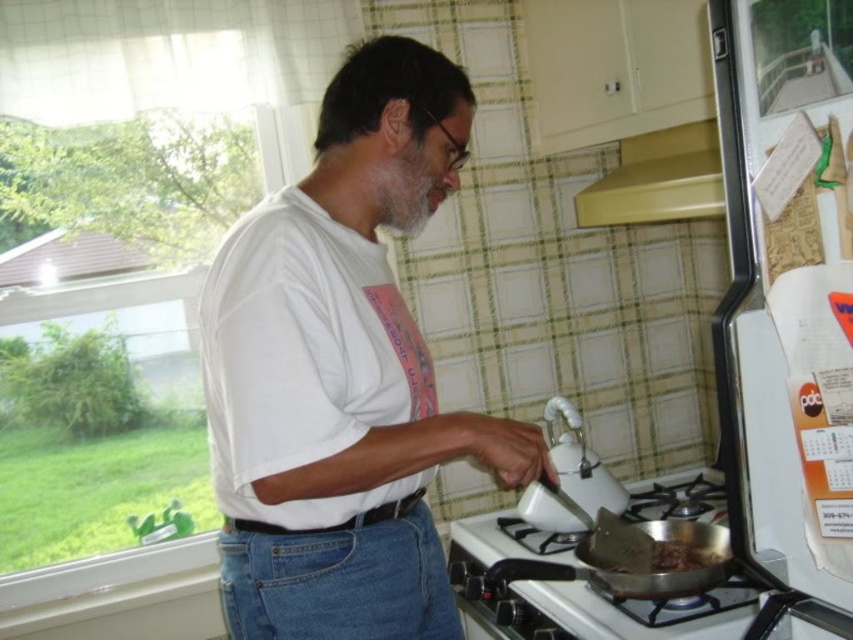
Does yellow matte exhaust hood at upper center have a lesser height compared to white glossy kettle at upper center?

Correct, yellow matte exhaust hood at upper center is not as tall as white glossy kettle at upper center.

Describe the element at coordinates (657, 179) in the screenshot. This screenshot has width=853, height=640. I see `yellow matte exhaust hood at upper center` at that location.

Locate an element on the screen. The image size is (853, 640). yellow matte exhaust hood at upper center is located at coordinates pos(657,179).

Between yellow matte exhaust hood at upper center and silver metallic frying pan at lower right, which one has more height?

With more height is yellow matte exhaust hood at upper center.

Between yellow matte exhaust hood at upper center and silver metallic frying pan at lower right, which one is positioned higher?

yellow matte exhaust hood at upper center is higher up.

The width and height of the screenshot is (853, 640). What do you see at coordinates (657, 179) in the screenshot? I see `yellow matte exhaust hood at upper center` at bounding box center [657, 179].

At what (x,y) coordinates should I click in order to perform the action: click on yellow matte exhaust hood at upper center. Please return your answer as a coordinate pair (x, y). The width and height of the screenshot is (853, 640). Looking at the image, I should click on (657, 179).

Find the location of a particular element. The image size is (853, 640). white glossy gas stove at lower center is located at coordinates tap(573, 593).